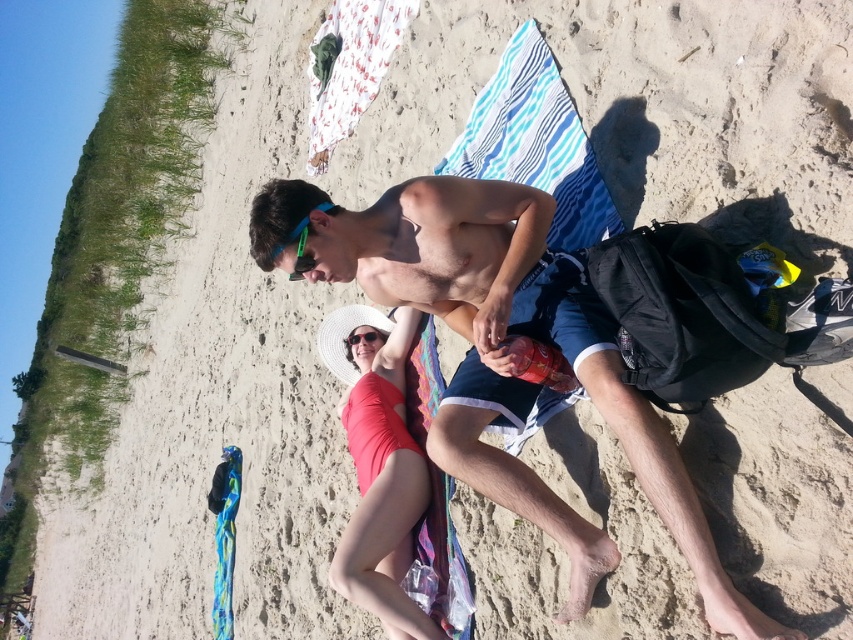
Question: Which of the following is the farthest from the observer?

Choices:
 (A) (482, 468)
 (B) (289, 237)

Answer: (B)

Question: Which object appears closest to the camera in this image?

Choices:
 (A) white woven hat at center
 (B) shiny metallic can at center

Answer: (B)

Question: Which point is closer to the camera?

Choices:
 (A) white woven hat at center
 (B) green matte goggles at center
 (C) green rubber earbuds at upper center

Answer: (B)

Question: Does green rubber earbuds at upper center have a larger size compared to green matte goggles at center?

Choices:
 (A) no
 (B) yes

Answer: (B)

Question: In this image, where is white woven hat at center located relative to green rubber earbuds at upper center?

Choices:
 (A) left
 (B) right

Answer: (B)

Question: Does white woven hat at center appear on the right side of green rubber earbuds at upper center?

Choices:
 (A) yes
 (B) no

Answer: (A)